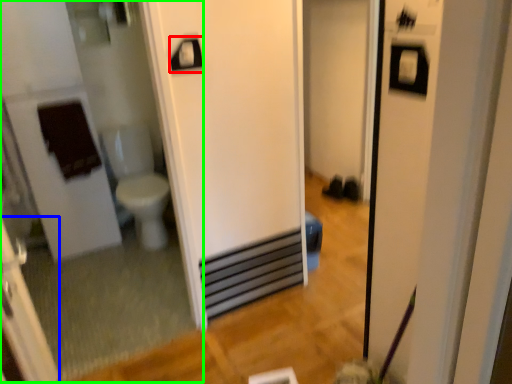
Question: Which is farther away from towel bar (highlighted by a red box)? screen door (highlighted by a blue box) or mirror (highlighted by a green box)?

Choices:
 (A) screen door
 (B) mirror

Answer: (B)